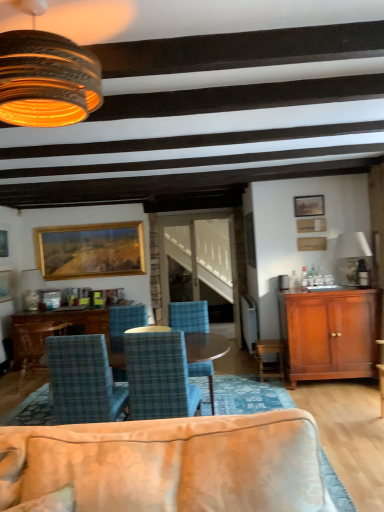
Question: Is wooden table at center thinner than blue plaid chair at center, the third chair when ordered from right to left?

Choices:
 (A) no
 (B) yes

Answer: (A)

Question: Can you confirm if wooden table at center is smaller than blue plaid chair at center, the 3th chair viewed from the back?

Choices:
 (A) no
 (B) yes

Answer: (A)

Question: Is wooden table at center far from blue plaid chair at center, the third chair when ordered from right to left?

Choices:
 (A) yes
 (B) no

Answer: (A)

Question: Can you confirm if wooden table at center is positioned to the left of blue plaid chair at center, the 3th chair viewed from the back?

Choices:
 (A) no
 (B) yes

Answer: (B)

Question: Is the position of wooden table at center more distant than that of blue plaid chair at center, the third chair when ordered from right to left?

Choices:
 (A) no
 (B) yes

Answer: (B)

Question: Can you confirm if wooden table at center is positioned to the right of blue plaid chair at center, which is counted as the 2th chair, starting from the front?

Choices:
 (A) yes
 (B) no

Answer: (B)

Question: Would you say mahogany wood cabinet at right is outside rustic wood lampshade at upper left, marked as the 1th lamp in a front-to-back arrangement?

Choices:
 (A) yes
 (B) no

Answer: (A)

Question: Is mahogany wood cabinet at right positioned behind rustic wood lampshade at upper left, the first lamp positioned from the left?

Choices:
 (A) no
 (B) yes

Answer: (B)

Question: Is mahogany wood cabinet at right turned away from rustic wood lampshade at upper left, marked as the 1th lamp in a front-to-back arrangement?

Choices:
 (A) yes
 (B) no

Answer: (B)

Question: Does mahogany wood cabinet at right have a larger size compared to rustic wood lampshade at upper left, positioned as the 2th lamp in bottom-to-top order?

Choices:
 (A) no
 (B) yes

Answer: (B)

Question: Can you confirm if mahogany wood cabinet at right is positioned to the left of rustic wood lampshade at upper left, marked as the 1th lamp in a front-to-back arrangement?

Choices:
 (A) yes
 (B) no

Answer: (B)

Question: From the image's perspective, is mahogany wood cabinet at right located beneath rustic wood lampshade at upper left, the 2th lamp from the back?

Choices:
 (A) no
 (B) yes

Answer: (B)

Question: Is wooden table at center oriented towards wooden picture frame at upper right, which appears as the third picture frame when viewed from the back?

Choices:
 (A) no
 (B) yes

Answer: (A)